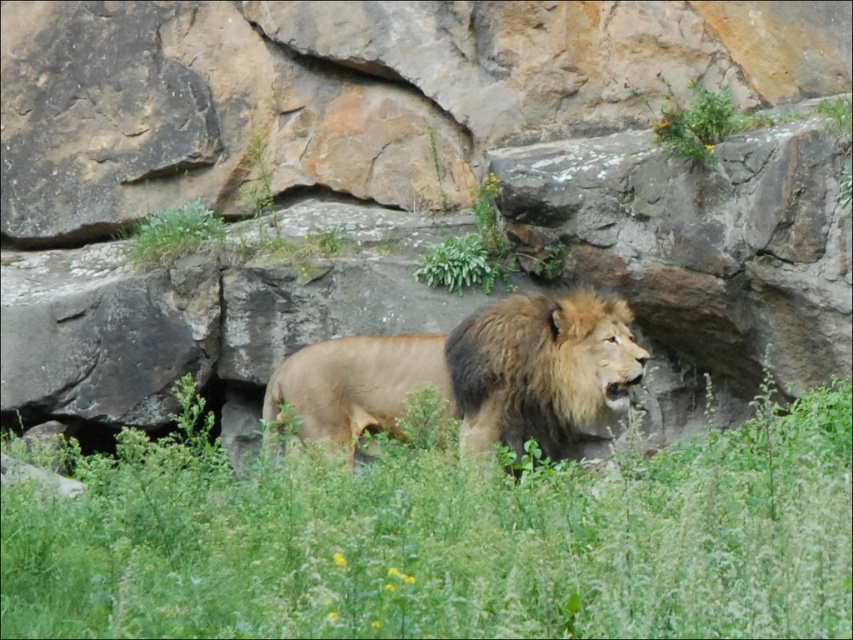
You are a zookeeper who needs to place a feeding tray for the golden fur lion at center. The tray must be placed on the green grassy area at center. Is the green grassy at center located in a suitable position below the lion to place the tray?

The green grassy at center is below the golden fur lion at center, so yes, the feeding tray can be placed on the green grassy at center since it is positioned beneath the lion, making it accessible for feeding.

You are a zookeeper planning to place a new feeding station in the enclosure. The feeding station requires a flat area larger than the golden fur lion at center. Based on the scene, is the green grassy at center suitable for placing the feeding station?

The green grassy at center is smaller than the golden fur lion at center, so it is not large enough to accommodate the feeding station which requires a flat area larger than the golden fur lion at center.